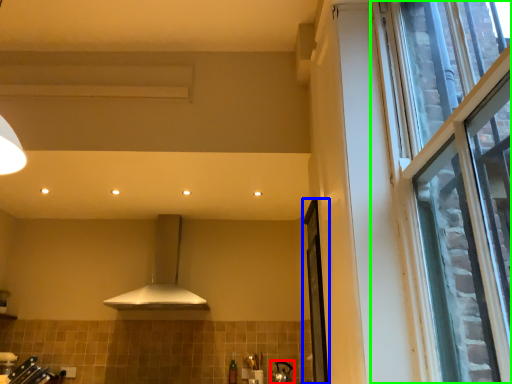
Question: Estimate the real-world distances between objects in this image. Which object is closer to appliance (highlighted by a red box), screen door (highlighted by a blue box) or window (highlighted by a green box)?

Choices:
 (A) screen door
 (B) window

Answer: (A)